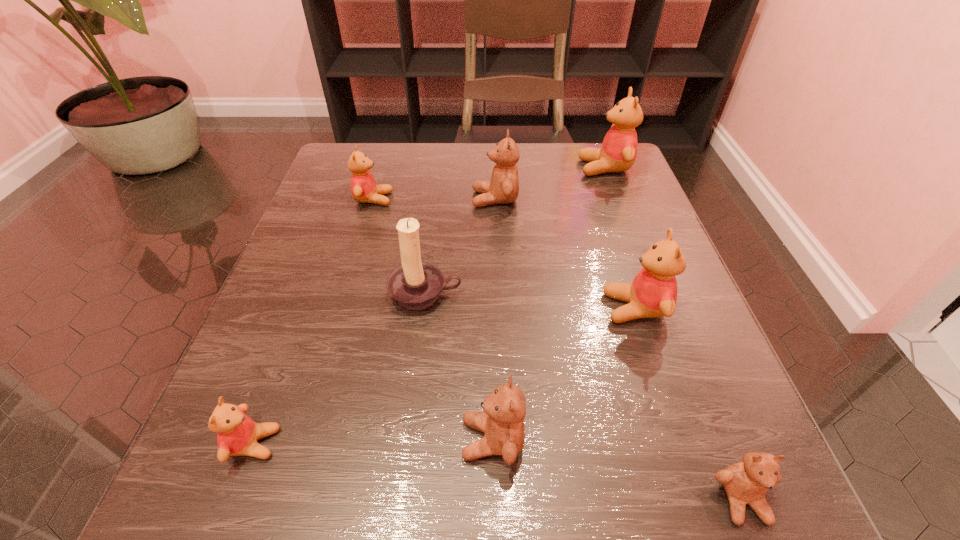
Where is `free space at the far edge`? The height and width of the screenshot is (540, 960). free space at the far edge is located at coordinates 446,154.

In the image, there is a desktop. In order to click on vacant space at the left edge in this screenshot , I will do `click(355, 242)`.

Where is `vacant region at the right edge of the desktop`? vacant region at the right edge of the desktop is located at coordinates (614, 278).

This screenshot has width=960, height=540. In order to click on vacant area at the far left corner of the desktop in this screenshot , I will do `click(383, 170)`.

Identify the location of free location at the near left corner of the desktop. (280, 516).

Where is `free region at the far right corner of the desktop`? The width and height of the screenshot is (960, 540). free region at the far right corner of the desktop is located at coordinates (640, 186).

Identify the location of free space that is in between the farthest red teddy bear and the brown candle holder. The width and height of the screenshot is (960, 540). (515, 231).

This screenshot has width=960, height=540. I want to click on free space between the farthest red teddy bear and the third object from left to right, so click(515, 231).

The image size is (960, 540). What are the coordinates of `vacant area between the third nearest red teddy bear and the rightmost brown teddy bear` in the screenshot? It's located at (558, 349).

You are a GUI agent. You are given a task and a screenshot of the screen. Output one action in this format:
    pyautogui.click(x=<x>, y=<y>)
    Task: Click on the free spot between the second farthest red teddy bear and the nearest red teddy bear
    The image size is (960, 540).
    Given the screenshot: What is the action you would take?
    pyautogui.click(x=314, y=321)